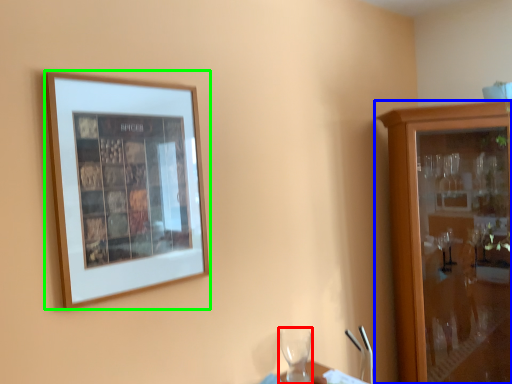
Question: Which object is the farthest from wine glass (highlighted by a red box)? Choose among these: cabinetry (highlighted by a blue box) or picture frame (highlighted by a green box).

Choices:
 (A) cabinetry
 (B) picture frame

Answer: (B)